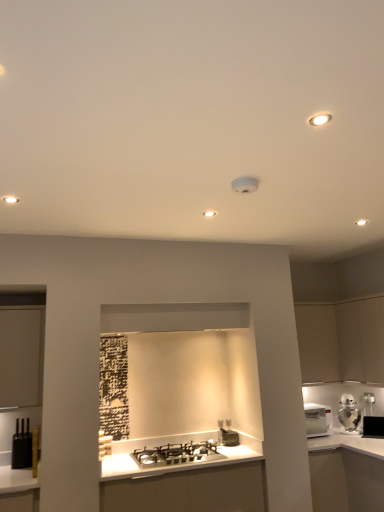
Question: Is black glossy microwave at upper right, marked as the first appliance in a right-to-left arrangement, completely or partially inside white matte cabinet at right, the second cabinetry in the left-to-right sequence?

Choices:
 (A) yes
 (B) no

Answer: (B)

Question: Is white matte cabinet at right, the 1th cabinetry when ordered from right to left, next to black glossy microwave at upper right, placed as the third appliance when sorted from left to right?

Choices:
 (A) no
 (B) yes

Answer: (A)

Question: Considering the relative sizes of white matte cabinet at right, the 1th cabinetry when ordered from right to left, and black glossy microwave at upper right, the third appliance in the front-to-back sequence, in the image provided, is white matte cabinet at right, the 1th cabinetry when ordered from right to left, thinner than black glossy microwave at upper right, the third appliance in the front-to-back sequence,?

Choices:
 (A) yes
 (B) no

Answer: (B)

Question: Is white matte cabinet at right, the second cabinetry in the left-to-right sequence, at the right side of black glossy microwave at upper right, which is the 1th appliance from back to front?

Choices:
 (A) yes
 (B) no

Answer: (B)

Question: From a real-world perspective, is white matte cabinet at right, the second cabinetry in the left-to-right sequence, below black glossy microwave at upper right, marked as the first appliance in a right-to-left arrangement?

Choices:
 (A) yes
 (B) no

Answer: (B)

Question: Is white matte cabinet at right, the 1th cabinetry when ordered from right to left, smaller than black glossy microwave at upper right, which is the 1th appliance from back to front?

Choices:
 (A) yes
 (B) no

Answer: (B)

Question: From the image's perspective, is metallic silver toaster at lower center, marked as the second appliance in a left-to-right arrangement, below white glossy microwave at right?

Choices:
 (A) no
 (B) yes

Answer: (B)

Question: Is metallic silver toaster at lower center, marked as the second appliance in a left-to-right arrangement, taller than white glossy microwave at right?

Choices:
 (A) no
 (B) yes

Answer: (A)

Question: Is the depth of metallic silver toaster at lower center, which is counted as the second appliance, starting from the right, less than that of white glossy microwave at right?

Choices:
 (A) yes
 (B) no

Answer: (A)

Question: Is metallic silver toaster at lower center, marked as the second appliance in a left-to-right arrangement, facing away from white glossy microwave at right?

Choices:
 (A) no
 (B) yes

Answer: (A)

Question: Is metallic silver toaster at lower center, which is the 2th appliance from back to front, not near white glossy microwave at right?

Choices:
 (A) no
 (B) yes

Answer: (A)

Question: Considering the relative positions of metallic silver toaster at lower center, which is counted as the second appliance, starting from the right, and white glossy microwave at right in the image provided, is metallic silver toaster at lower center, which is counted as the second appliance, starting from the right, to the right of white glossy microwave at right from the viewer's perspective?

Choices:
 (A) yes
 (B) no

Answer: (B)

Question: From a real-world perspective, is matte white cabinet at right, which is counted as the 1th cabinetry, starting from the left, physically below black glossy microwave at upper right, the third appliance in the front-to-back sequence?

Choices:
 (A) yes
 (B) no

Answer: (B)